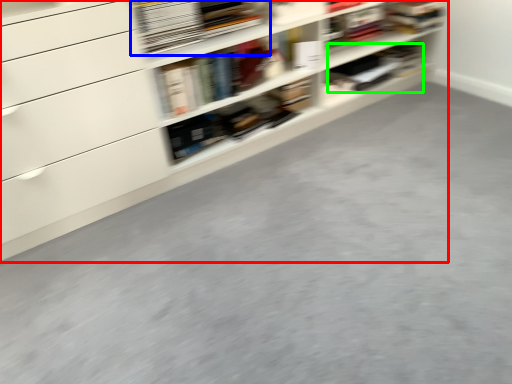
Question: Which object is the closest to the shelf (highlighted by a red box)? Choose among these: book (highlighted by a blue box) or book (highlighted by a green box).

Choices:
 (A) book
 (B) book

Answer: (A)